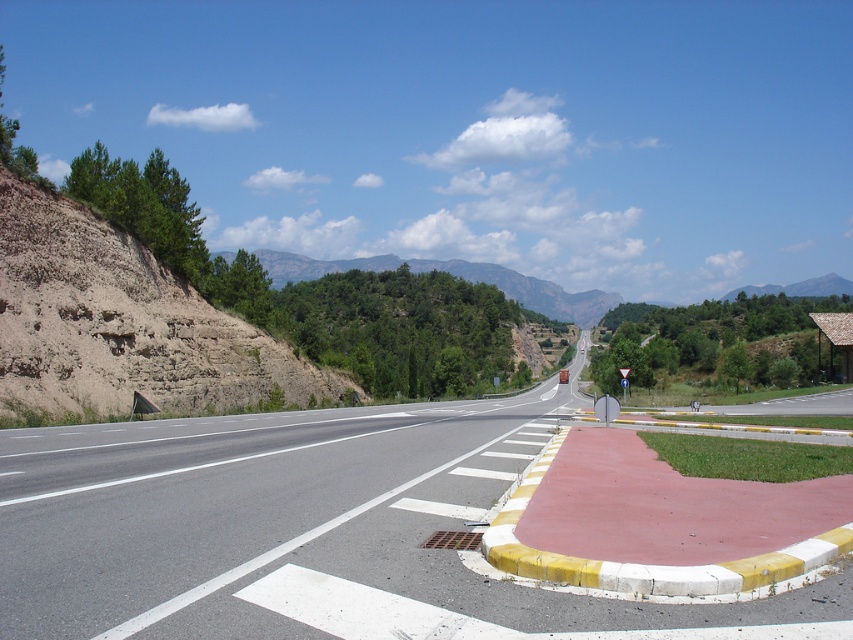
Question: Does asphalt road at center have a lesser width compared to green forested mountain at upper center?

Choices:
 (A) no
 (B) yes

Answer: (B)

Question: Which object is closer to the camera taking this photo?

Choices:
 (A) brown rocky cliff at left
 (B) asphalt road at center

Answer: (B)

Question: Estimate the real-world distances between objects in this image. Which object is closer to the asphalt road at center?

Choices:
 (A) brown rocky cliff at left
 (B) green forested mountain at upper center

Answer: (A)

Question: Is brown rocky cliff at left further to camera compared to green forested mountain at upper center?

Choices:
 (A) no
 (B) yes

Answer: (A)

Question: Which point is closer to the camera taking this photo?

Choices:
 (A) (114, 531)
 (B) (149, 268)
 (C) (339, 266)

Answer: (A)

Question: Is asphalt road at center behind green forested mountain at upper center?

Choices:
 (A) yes
 (B) no

Answer: (B)